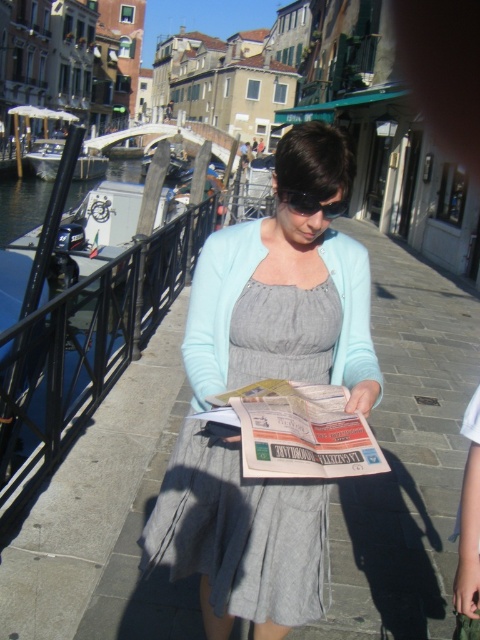
Question: Which object is closer to the camera taking this photo?

Choices:
 (A) black plastic sunglasses at center
 (B) gray concrete pavement at center
 (C) gray cotton dress at center

Answer: (C)

Question: Does gray concrete pavement at center have a greater width compared to black plastic sunglasses at center?

Choices:
 (A) yes
 (B) no

Answer: (A)

Question: Does gray concrete pavement at center appear over black plastic sunglasses at center?

Choices:
 (A) yes
 (B) no

Answer: (B)

Question: Which of the following is the farthest from the observer?

Choices:
 (A) (299, 198)
 (B) (297, 595)
 (C) (375, 570)

Answer: (C)

Question: Which point appears closest to the camera in this image?

Choices:
 (A) (322, 346)
 (B) (429, 636)

Answer: (A)

Question: Is gray concrete pavement at center thinner than gray cotton dress at center?

Choices:
 (A) no
 (B) yes

Answer: (A)